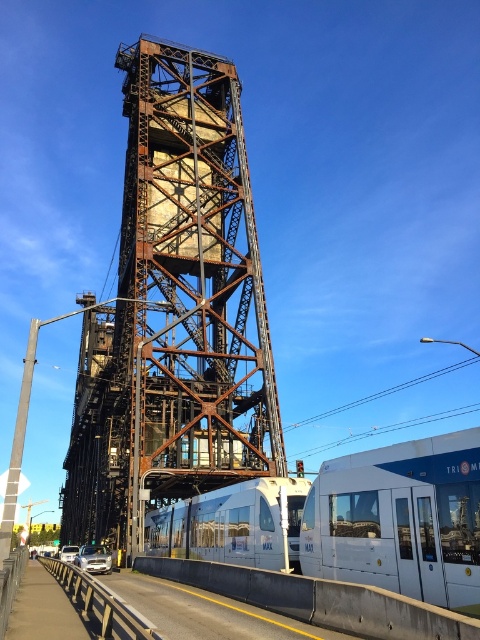
Question: Which object is positioned closest to the white glossy train at lower right?

Choices:
 (A) rusty metal tower at center
 (B) white glossy passenger train at lower center

Answer: (B)

Question: In this image, where is rusty metal tower at center located relative to white glossy passenger train at lower center?

Choices:
 (A) left
 (B) right

Answer: (A)

Question: Is rusty metal tower at center thinner than white glossy passenger train at lower center?

Choices:
 (A) no
 (B) yes

Answer: (A)

Question: Which object is farther from the camera taking this photo?

Choices:
 (A) white glossy passenger train at lower center
 (B) white glossy train at lower right

Answer: (A)

Question: Which of the following is the closest to the observer?

Choices:
 (A) (195, 554)
 (B) (176, 480)

Answer: (A)

Question: Is white glossy train at lower right positioned in front of white glossy passenger train at lower center?

Choices:
 (A) no
 (B) yes

Answer: (B)